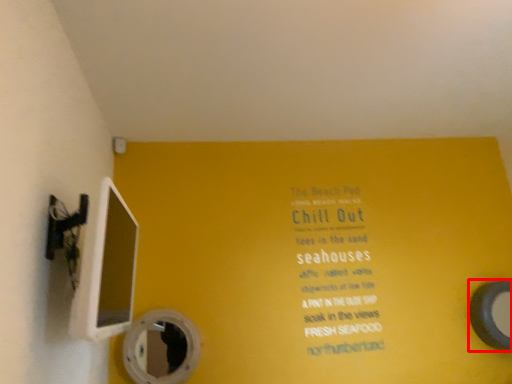
Question: From the image's perspective, what is the correct spatial relationship of mirror (annotated by the red box) in relation to mirror?

Choices:
 (A) below
 (B) above

Answer: (B)